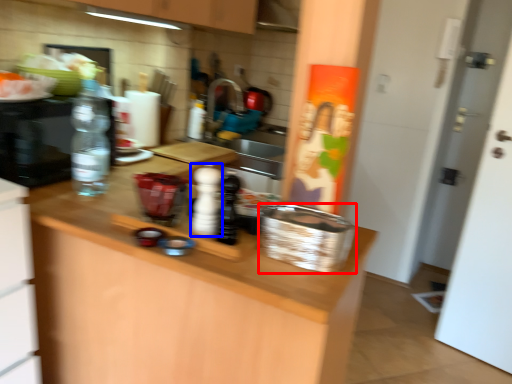
Question: Which point is further to the camera, basket (highlighted by a red box) or bottle (highlighted by a blue box)?

Choices:
 (A) basket
 (B) bottle

Answer: (B)